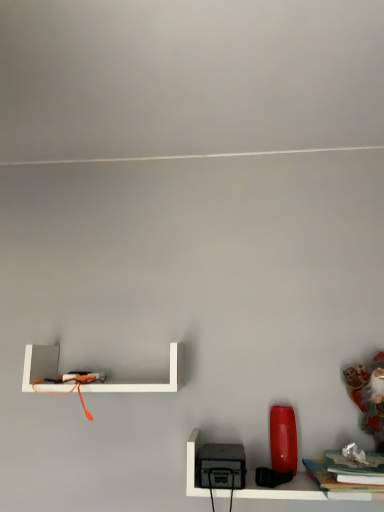
Question: Is velvet santa at right not near matte black toaster at lower right, the 2th shelf positioned from the left?

Choices:
 (A) no
 (B) yes

Answer: (A)

Question: From a real-world perspective, does velvet santa at right stand above matte black toaster at lower right, the 2th shelf positioned from the top?

Choices:
 (A) yes
 (B) no

Answer: (A)

Question: Does velvet santa at right have a greater width compared to matte black toaster at lower right, which is counted as the first shelf, starting from the bottom?

Choices:
 (A) no
 (B) yes

Answer: (A)

Question: Is velvet santa at right in contact with matte black toaster at lower right, the first shelf from the right?

Choices:
 (A) yes
 (B) no

Answer: (B)

Question: Does velvet santa at right have a lesser width compared to matte black toaster at lower right, which is counted as the first shelf, starting from the bottom?

Choices:
 (A) no
 (B) yes

Answer: (B)

Question: From a real-world perspective, relative to velvet santa at right, is matte black toaster at lower right, the 2th shelf positioned from the left, vertically above or below?

Choices:
 (A) below
 (B) above

Answer: (A)

Question: Choose the correct answer: Is matte black toaster at lower right, the 2th shelf positioned from the top, inside velvet santa at right or outside it?

Choices:
 (A) outside
 (B) inside

Answer: (A)

Question: Relative to velvet santa at right, is matte black toaster at lower right, the first shelf from the right, in front or behind?

Choices:
 (A) behind
 (B) front

Answer: (B)

Question: Is point pos(246,495) positioned closer to the camera than point pos(380,422)?

Choices:
 (A) closer
 (B) farther

Answer: (A)

Question: Considering the positions of point (284, 497) and point (170, 361), is point (284, 497) closer or farther from the camera than point (170, 361)?

Choices:
 (A) closer
 (B) farther

Answer: (A)

Question: From the image's perspective, relative to white matte shelf at upper left, the 2th shelf ordered from the bottom, is matte black toaster at lower right, the 2th shelf positioned from the top, above or below?

Choices:
 (A) above
 (B) below

Answer: (B)

Question: In terms of width, does matte black toaster at lower right, the 2th shelf positioned from the left, look wider or thinner when compared to white matte shelf at upper left, the 2th shelf ordered from the bottom?

Choices:
 (A) thin
 (B) wide

Answer: (B)

Question: Looking at the image, does matte black toaster at lower right, the 2th shelf positioned from the top, seem bigger or smaller compared to white matte shelf at upper left, which is the first shelf from top to bottom?

Choices:
 (A) big
 (B) small

Answer: (A)

Question: Considering the positions of point (24, 387) and point (379, 435), is point (24, 387) closer or farther from the camera than point (379, 435)?

Choices:
 (A) farther
 (B) closer

Answer: (A)

Question: From the image's perspective, is white matte shelf at upper left, which is the first shelf from top to bottom, located above or below velvet santa at right?

Choices:
 (A) below
 (B) above

Answer: (B)